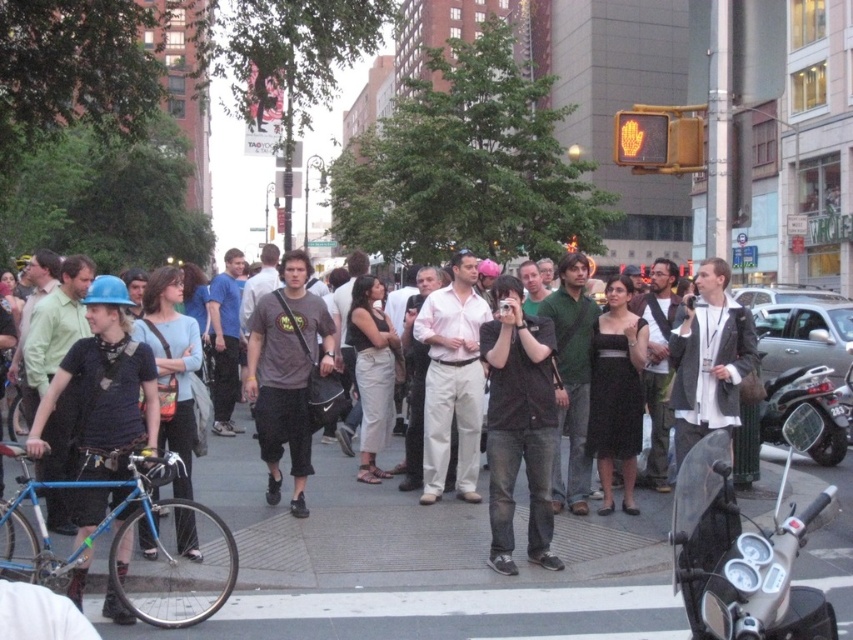
Question: Can you confirm if matte black shirt at center is bigger than matte gray t-shirt at center?

Choices:
 (A) yes
 (B) no

Answer: (B)

Question: Which of the following is the closest to the observer?

Choices:
 (A) matte blue helmet at left
 (B) metallic silver scooter at lower right
 (C) shiny black scooter at right

Answer: (B)

Question: Among these objects, which one is farthest from the camera?

Choices:
 (A) metallic silver scooter at lower right
 (B) matte blue helmet at left
 (C) black matte shirt at center
 (D) matte gray t-shirt at center

Answer: (D)

Question: In this image, where is metallic silver scooter at lower right located relative to black matte shirt at center?

Choices:
 (A) below
 (B) above

Answer: (A)

Question: Which point is closer to the camera taking this photo?

Choices:
 (A) (224, 502)
 (B) (531, 371)
 (C) (779, 417)
 (D) (299, 372)

Answer: (B)

Question: Is matte black shirt at center thinner than black matte shirt at center?

Choices:
 (A) no
 (B) yes

Answer: (A)